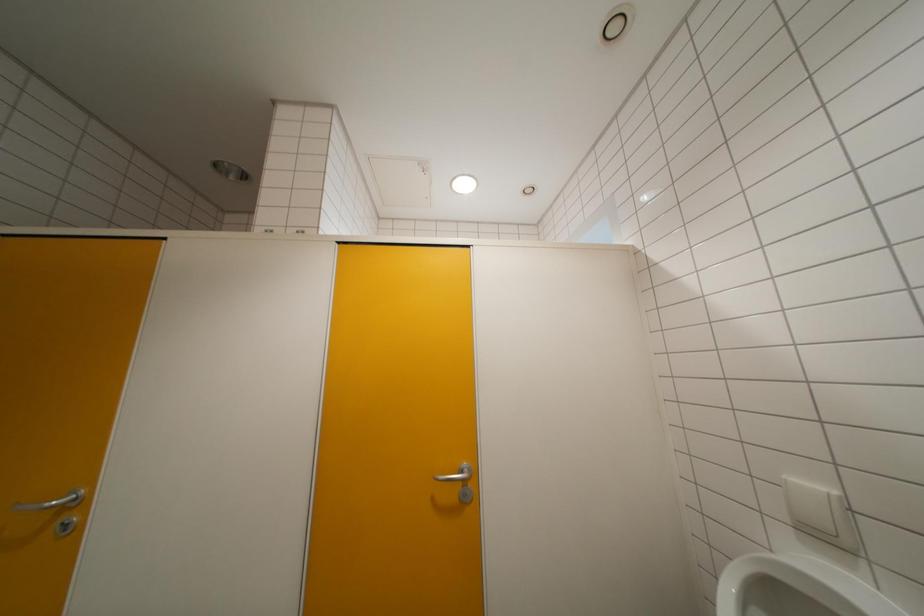
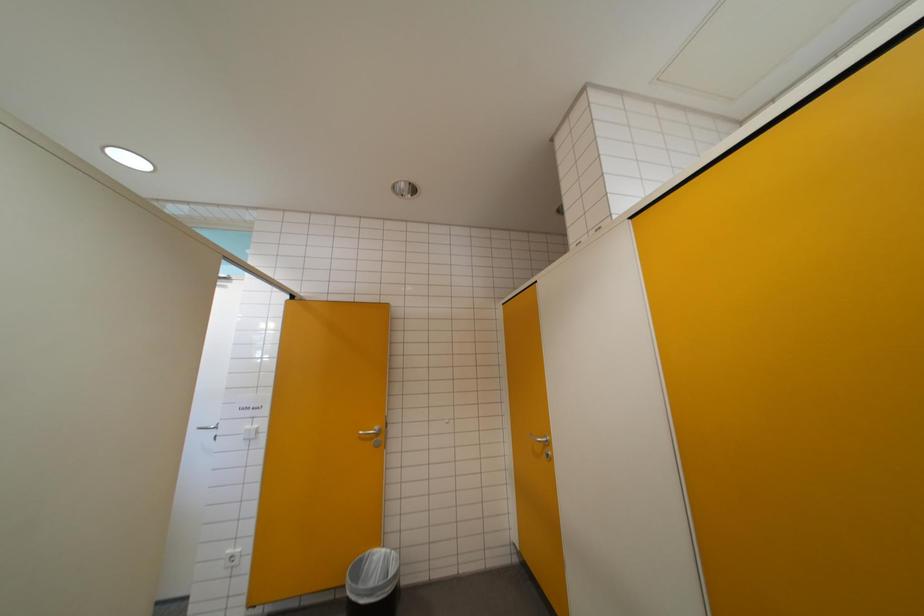
Question: The first image is from the beginning of the video and the second image is from the end. How did the camera likely rotate when shooting the video?

Choices:
 (A) Left
 (B) Right
 (C) Up
 (D) Down

Answer: (A)